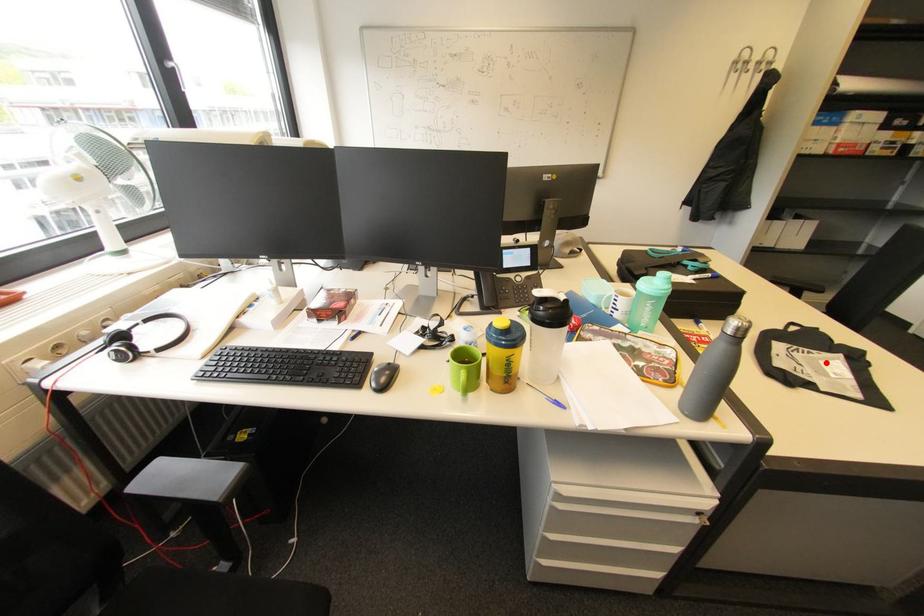
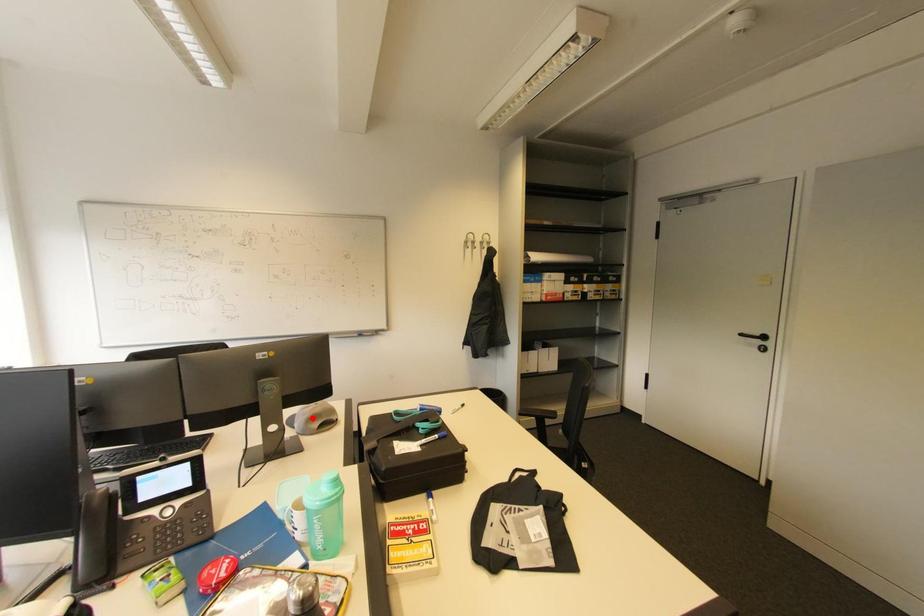
I am providing you with two images of the same scene from different viewpoints. A red point is marked on the first image and another point is marked on the second image. Does the point marked in image1 correspond to the same location as the one in image2?

No